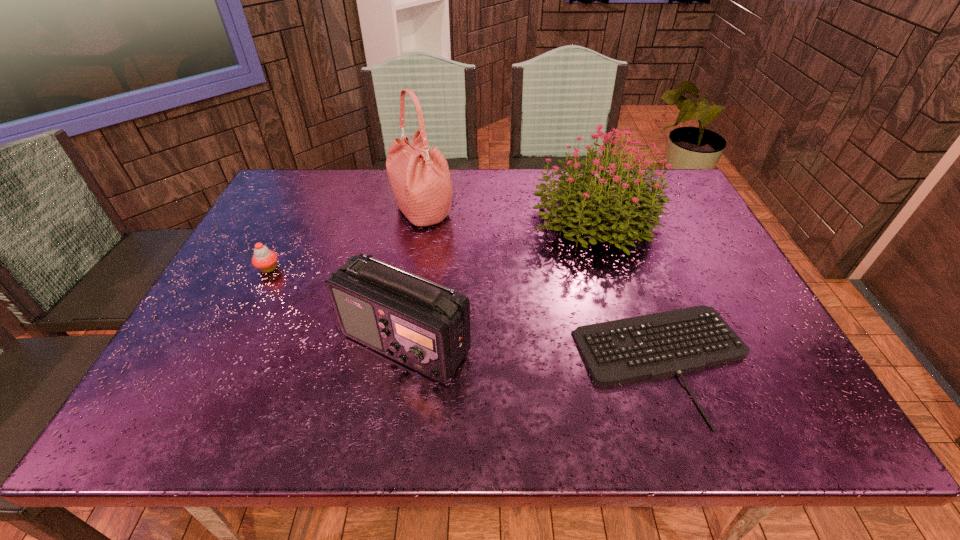
In the image, there is a desktop. At what (x,y) coordinates should I click in order to perform the action: click on vacant region at the near edge. Please return your answer as a coordinate pair (x, y). Image resolution: width=960 pixels, height=540 pixels. Looking at the image, I should click on (258, 399).

This screenshot has height=540, width=960. What are the coordinates of `free space at the left edge of the desktop` in the screenshot? It's located at 217,347.

What are the coordinates of `vacant space at the far left corner` in the screenshot? It's located at (290, 210).

You are a GUI agent. You are given a task and a screenshot of the screen. Output one action in this format:
    pyautogui.click(x=<x>, y=<y>)
    Task: Click on the free space between the third tallest object and the computer keyboard
    This screenshot has width=960, height=540.
    Given the screenshot: What is the action you would take?
    pyautogui.click(x=535, y=353)

Identify the location of unoccupied position between the bouquet and the tallest object. (508, 214).

At what (x,y) coordinates should I click in order to perform the action: click on vacant area that lies between the shortest object and the bouquet. Please return your answer as a coordinate pair (x, y). Looking at the image, I should click on (630, 289).

Identify the location of free spot between the shortest object and the handbag. The height and width of the screenshot is (540, 960). (543, 286).

What are the coordinates of `vacant area that lies between the third shortest object and the computer keyboard` in the screenshot? It's located at (535, 353).

The image size is (960, 540). I want to click on object that stands as the closest to the third shortest object, so click(657, 345).

This screenshot has height=540, width=960. Identify the location of object that is the third closest to the leftmost object. (586, 197).